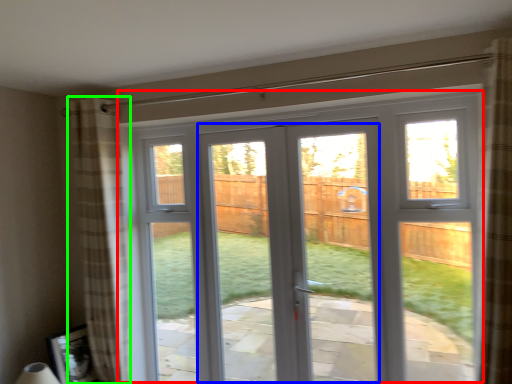
Question: Estimate the real-world distances between objects in this image. Which object is farther from window (highlighted by a red box), screen door (highlighted by a blue box) or curtain (highlighted by a green box)?

Choices:
 (A) screen door
 (B) curtain

Answer: (A)